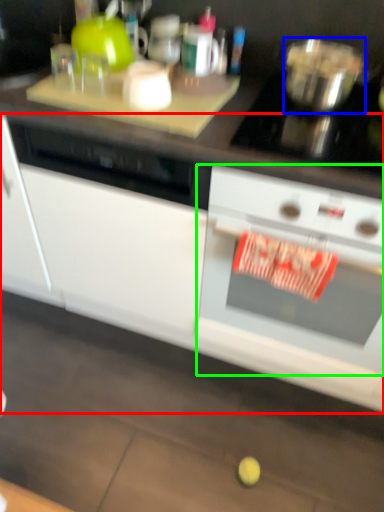
Question: Estimate the real-world distances between objects in this image. Which object is closer to cabinetry (highlighted by a red box), bowl (highlighted by a blue box) or kitchen appliance (highlighted by a green box)?

Choices:
 (A) bowl
 (B) kitchen appliance

Answer: (B)